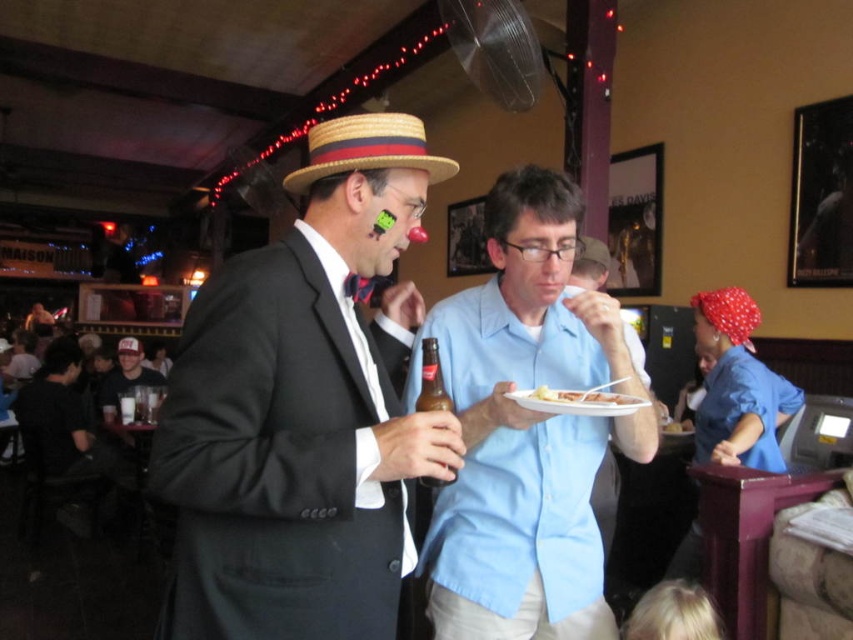
Question: Which point is farther to the camera?

Choices:
 (A) light blue shirt at center
 (B) matte black suit at center
 (C) straw hat at center
 (D) white paper plate at center

Answer: (A)

Question: Does white paper plate at center appear on the right side of brown glass bottle at center?

Choices:
 (A) no
 (B) yes

Answer: (B)

Question: Where is light blue cotton shirt at center located in relation to straw hat at center in the image?

Choices:
 (A) below
 (B) above

Answer: (A)

Question: Among these objects, which one is nearest to the camera?

Choices:
 (A) matte black suit at center
 (B) white paper plate at center
 (C) straw hat at center
 (D) light blue cotton shirt at center

Answer: (A)

Question: Observing the image, what is the correct spatial positioning of straw hat at center in reference to light blue shirt at center?

Choices:
 (A) below
 (B) above

Answer: (B)

Question: Based on their relative distances, which object is nearer to the white cotton t-shirt at lower left?

Choices:
 (A) straw hat at center
 (B) light blue shirt at center
 (C) matte black suit at center
 (D) white paper plate at center

Answer: (B)